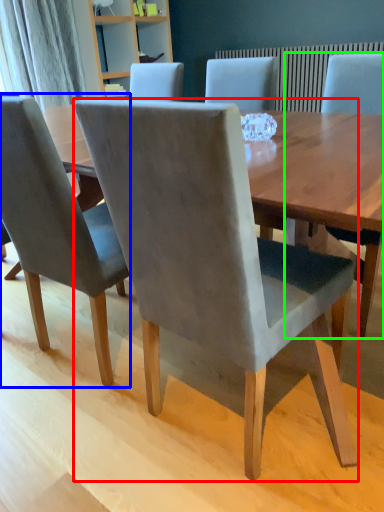
Question: Which is nearer to the chair (highlighted by a red box)? chair (highlighted by a blue box) or chair (highlighted by a green box).

Choices:
 (A) chair
 (B) chair

Answer: (A)